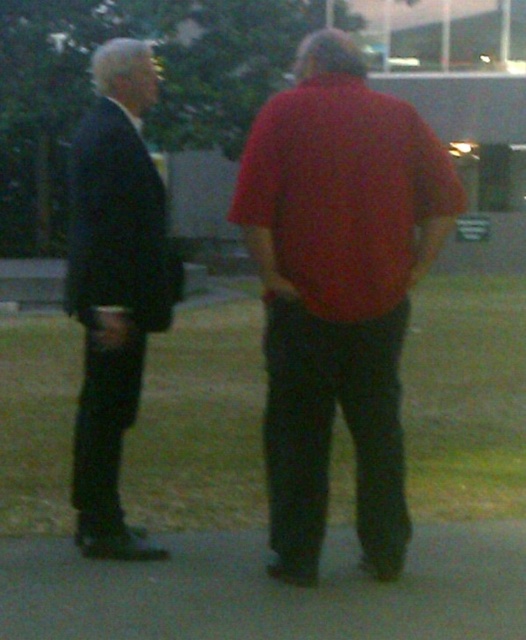
Is matte red shirt at center below matte black suit at left?

Indeed, matte red shirt at center is positioned under matte black suit at left.

Can you confirm if matte red shirt at center is positioned to the right of matte black suit at left?

Yes, matte red shirt at center is to the right of matte black suit at left.

Between point (373, 138) and point (135, 140), which one is positioned behind?

The point (135, 140) is more distant.

You are a GUI agent. You are given a task and a screenshot of the screen. Output one action in this format:
    pyautogui.click(x=<x>, y=<y>)
    Task: Click on the matte red shirt at center
    This screenshot has width=526, height=640.
    Given the screenshot: What is the action you would take?
    pyautogui.click(x=338, y=291)